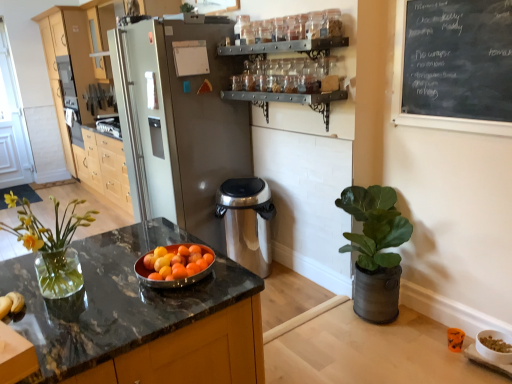
Question: Would you say white glossy bowl at lower right is to the left or to the right of black chalkboard at upper right in the picture?

Choices:
 (A) right
 (B) left

Answer: (A)

Question: Considering the positions of point (493, 332) and point (476, 129), is point (493, 332) closer or farther from the camera than point (476, 129)?

Choices:
 (A) closer
 (B) farther

Answer: (B)

Question: Which object is the farthest from the satin silver refrigerator at center?

Choices:
 (A) light wood cabinetry at left
 (B) stainless steel trash can at center
 (C) black marble countertop at center
 (D) white glossy bowl at lower right
 (E) clear glass vase at left

Answer: (D)

Question: Which object is positioned closest to the black chalkboard at upper right?

Choices:
 (A) satin silver refrigerator at center
 (B) white glossy bowl at lower right
 (C) black marble countertop at center
 (D) light wood cabinetry at left
 (E) green matte plant at right

Answer: (E)